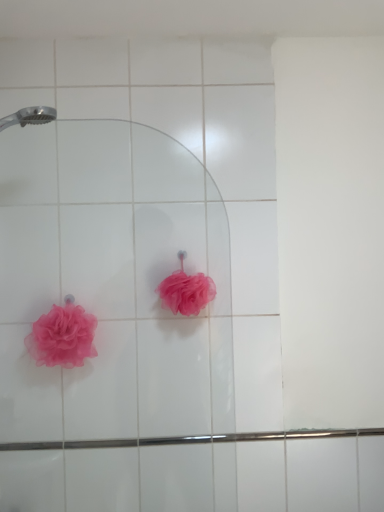
Question: Which is correct: pink matte loofah at center, marked as the first rose in a right-to-left arrangement, is inside pink mesh sponge at lower left, the second rose in the right-to-left sequence, or outside of it?

Choices:
 (A) outside
 (B) inside

Answer: (A)

Question: From a real-world perspective, is pink matte loofah at center, marked as the first rose in a right-to-left arrangement, above or below pink mesh sponge at lower left, the second rose in the right-to-left sequence?

Choices:
 (A) above
 (B) below

Answer: (A)

Question: Is point (170, 284) positioned closer to the camera than point (66, 349)?

Choices:
 (A) farther
 (B) closer

Answer: (B)

Question: Looking at their shapes, would you say pink mesh sponge at lower left, the first rose when ordered from left to right, is wider or thinner than pink matte loofah at center, which appears as the second rose when viewed from the left?

Choices:
 (A) thin
 (B) wide

Answer: (A)

Question: Based on their positions, is pink mesh sponge at lower left, the first rose when ordered from left to right, located to the left or right of pink matte loofah at center, marked as the first rose in a right-to-left arrangement?

Choices:
 (A) right
 (B) left

Answer: (B)

Question: From the image's perspective, is pink mesh sponge at lower left, the first rose when ordered from left to right, positioned above or below pink matte loofah at center, marked as the first rose in a right-to-left arrangement?

Choices:
 (A) above
 (B) below

Answer: (B)

Question: From a real-world perspective, is pink mesh sponge at lower left, the second rose in the right-to-left sequence, above or below pink matte loofah at center, marked as the first rose in a right-to-left arrangement?

Choices:
 (A) below
 (B) above

Answer: (A)